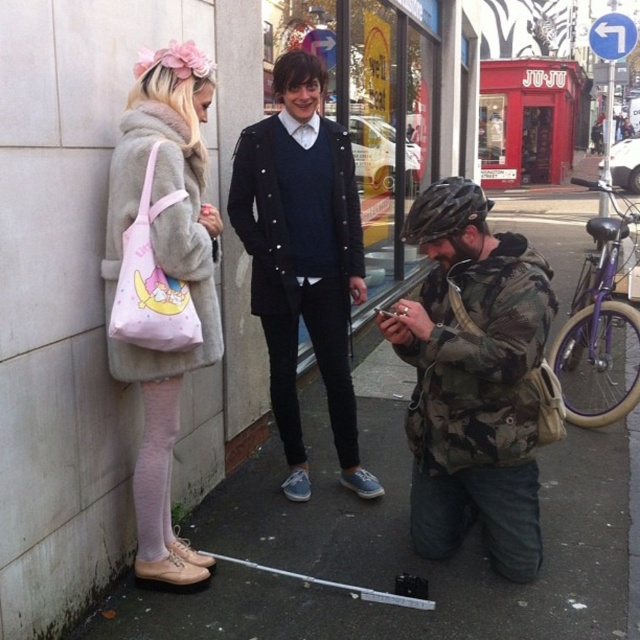
You are a delivery person trying to navigate through the street. The fuzzy beige coat at left and the red matte storefront at center are in your path. Which one do you need to maneuver around first?

The fuzzy beige coat at left occupies less space than the red matte storefront at center, so you should maneuver around the fuzzy beige coat at left first to avoid the larger obstacle.

You are a delivery person trying to navigate through the street scene. You need to deliver a package to the location marked by point [266,257]. There is an obstacle at point [406,557]. Can you safely reach the destination without going around the obstacle?

Point [406,557] is in front of point [266,257], so you cannot reach the destination without moving around the obstacle at point [406,557].